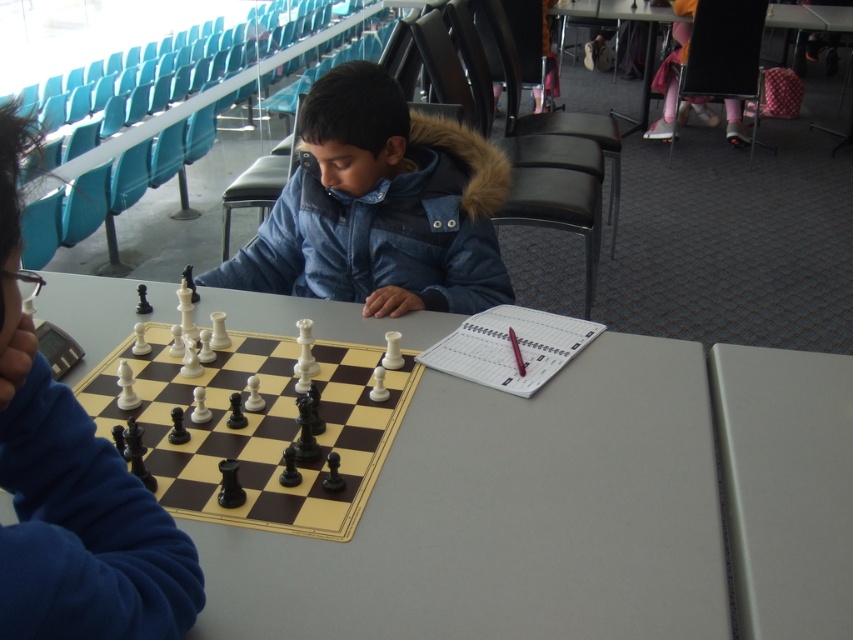
You are a chess player sitting at the white matte table at center. You want to place a chess piece on the white plastic chessboard at center. Is the chessboard within your reach?

The white plastic chessboard at center is not as tall as the white matte table at center, so yes, the chessboard is within reach since it is placed on the table and lower in height.

You are standing in front of a chessboard and want to place a large chess piece that requires 36 inches of space. Can the smooth plastic table at center accommodate it?

The smooth plastic table at center is 36.28 inches from viewer, so yes, it can accommodate the large chess piece requiring 36 inches of space.

You are a person who is 1.7 meters tall. You are standing in front of the smooth plastic table at center and the denim jacket at center. Which object is closer to your eye level?

The denim jacket at center is taller than the smooth plastic table at center, so your eye level is closer to the denim jacket at center.